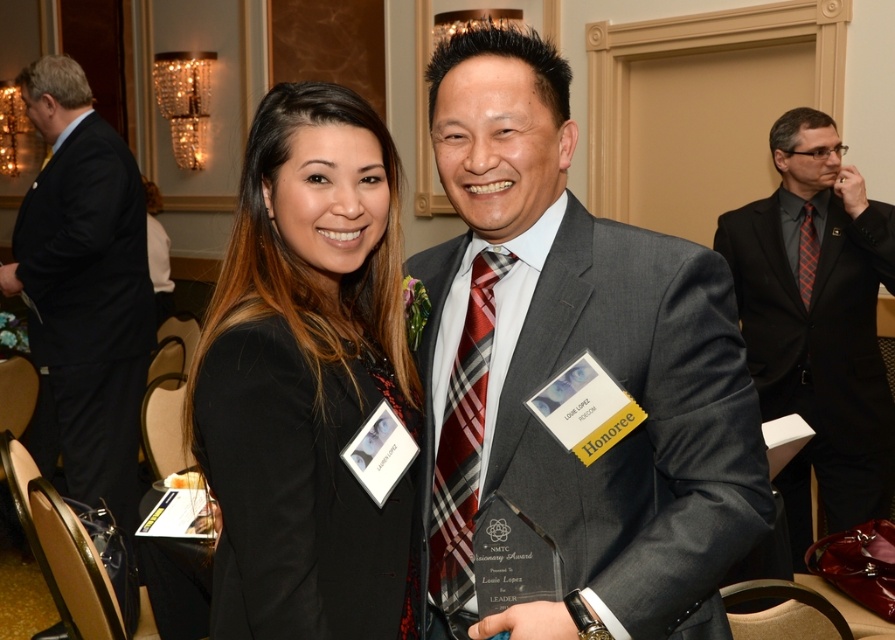
Which is behind, point (654, 397) or point (454, 531)?

The point (454, 531) is more distant.

Which of these two, gray suit at center or plaid silk tie at center, stands shorter?

plaid silk tie at center

Describe the element at coordinates (573, 356) in the screenshot. I see `gray suit at center` at that location.

Where is `gray suit at center`? The image size is (895, 640). gray suit at center is located at coordinates (573, 356).

How much distance is there between black matte blazer at center and orange plaid tie at right?

7.69 feet

Who is more forward, (303, 625) or (806, 308)?

Point (303, 625)

Identify the location of black matte blazer at center. (305, 378).

Does matte black suit at right lie in front of black suit at left?

Yes, matte black suit at right is in front of black suit at left.

Is point (832, 333) closer to viewer compared to point (92, 444)?

Yes, it is.

Image resolution: width=895 pixels, height=640 pixels. Find the location of `matte black suit at right`. matte black suit at right is located at coordinates (817, 324).